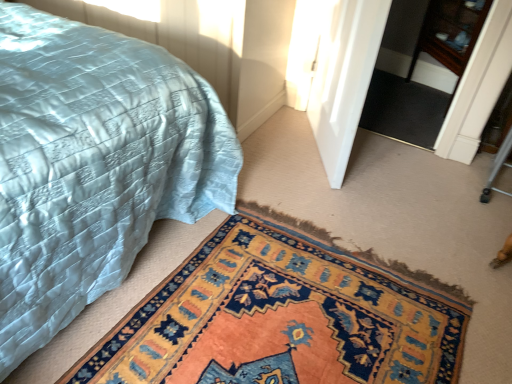
Find the location of a particular element. This screenshot has height=384, width=512. vacant space in front of wooden dresser at upper right is located at coordinates (402, 124).